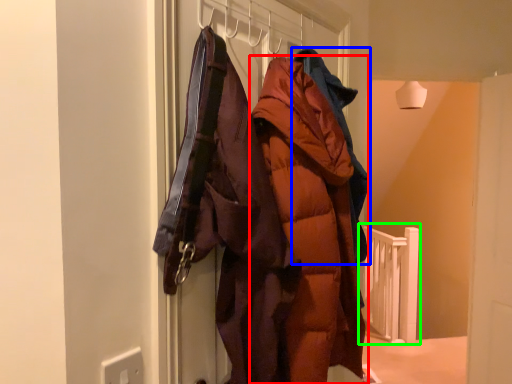
Question: Estimate the real-world distances between objects in this image. Which object is farther from coat (highlighted by a red box), jacket (highlighted by a blue box) or rail (highlighted by a green box)?

Choices:
 (A) jacket
 (B) rail

Answer: (B)